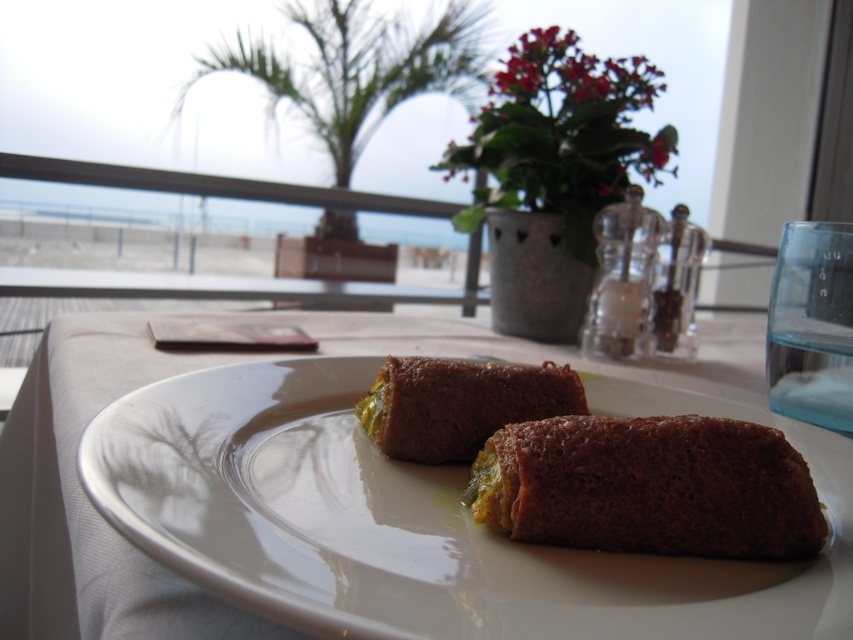
Consider the image. Is brown crispy pastry at center thinner than dark brown crumbly cake at center?

No, brown crispy pastry at center is not thinner than dark brown crumbly cake at center.

Between point (850, 596) and point (796, 532), which one is positioned in front?

Point (850, 596) is in front.

At what (x,y) coordinates should I click in order to perform the action: click on brown crispy pastry at center. Please return your answer as a coordinate pair (x, y). The image size is (853, 640). Looking at the image, I should click on (421, 520).

Does brown crispy pastry at center have a larger size compared to brown crumbly cake at center?

Yes, brown crispy pastry at center is bigger than brown crumbly cake at center.

Where is `brown crispy pastry at center`? The height and width of the screenshot is (640, 853). brown crispy pastry at center is located at coordinates (421, 520).

Locate an element on the screen. dark brown crumbly cake at center is located at coordinates (648, 486).

The image size is (853, 640). What are the coordinates of `dark brown crumbly cake at center` in the screenshot? It's located at tap(648, 486).